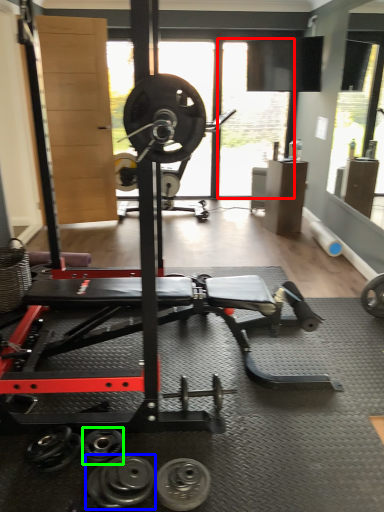
Question: Considering the real-world distances, which object is closest to window screen (highlighted by a red box)? dumbbell (highlighted by a blue box) or dumbbell (highlighted by a green box).

Choices:
 (A) dumbbell
 (B) dumbbell

Answer: (B)